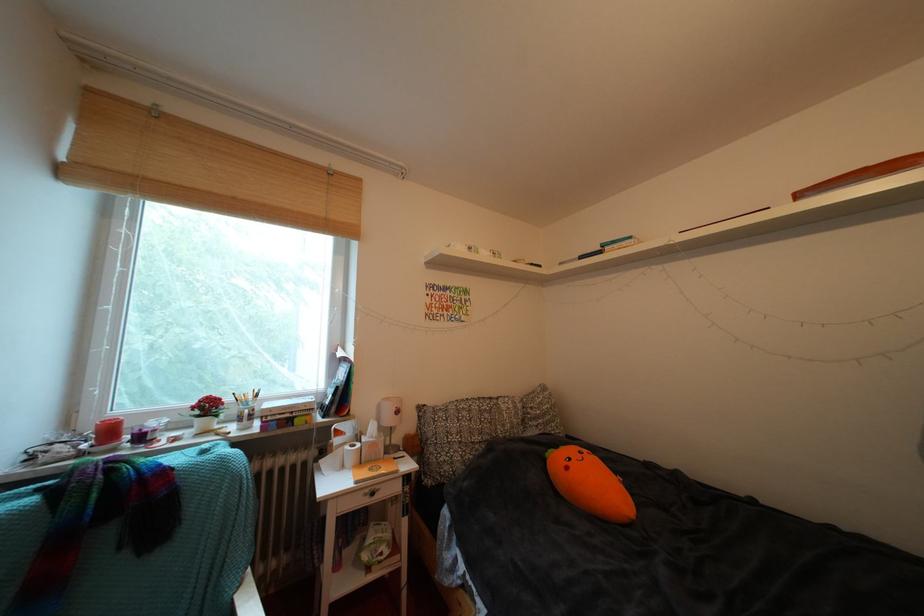
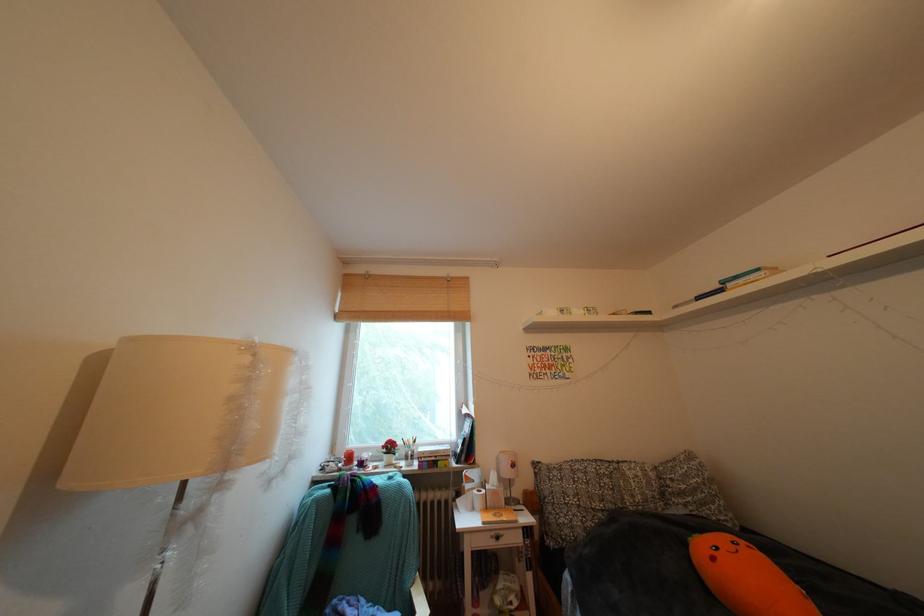
Where in the second image is the point corresponding to point 640,243 from the first image?

(768, 275)